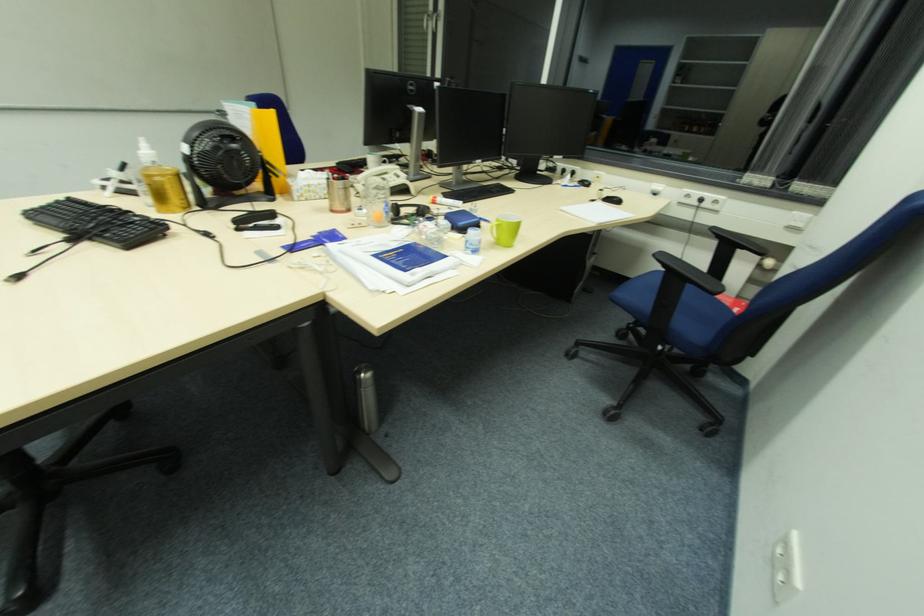
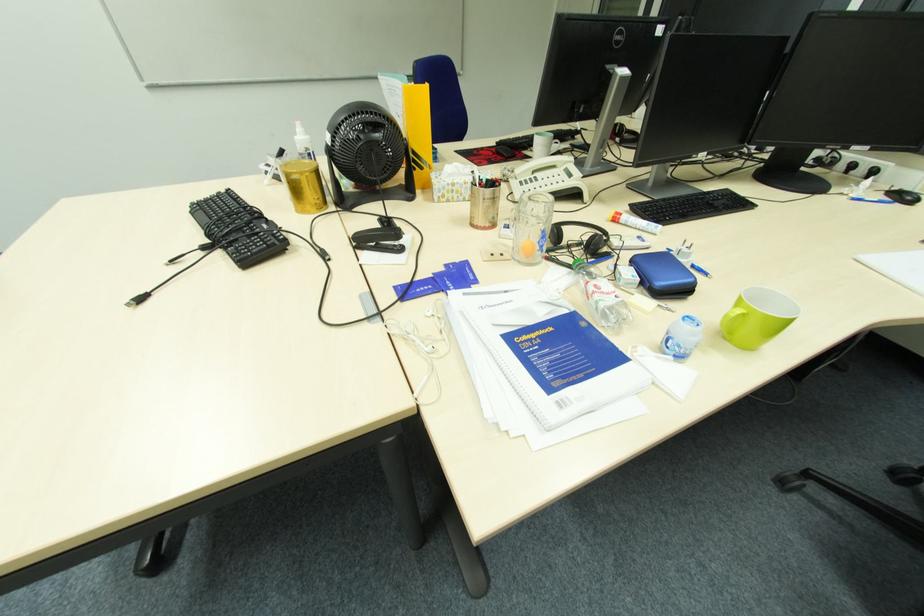
Question: Which direction would the cameraman need to move to produce the second image? Reply with the corresponding letter.

Choices:
 (A) Left
 (B) Right
 (C) Forward
 (D) Backward

Answer: (C)